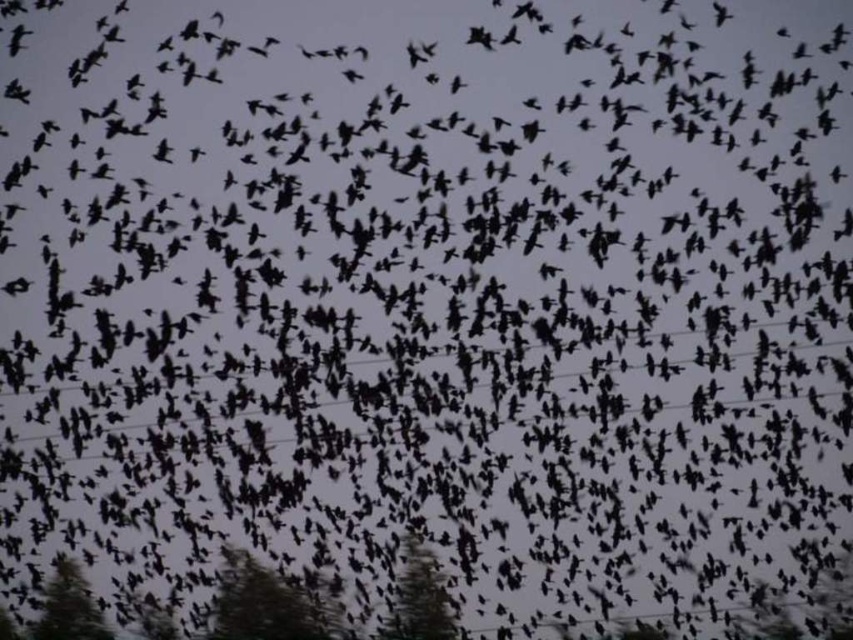
Question: Which object is positioned farthest from the green textured tree at center?

Choices:
 (A) green matte tree at lower left
 (B) green matte tree at lower center

Answer: (A)

Question: In this image, where is green matte tree at lower center located relative to green textured tree at center?

Choices:
 (A) left
 (B) right

Answer: (A)

Question: Does green matte tree at lower center have a smaller size compared to green textured tree at center?

Choices:
 (A) yes
 (B) no

Answer: (A)

Question: Which of these objects is positioned closest to the green matte tree at lower left?

Choices:
 (A) green textured tree at center
 (B) green matte tree at lower center

Answer: (B)

Question: Which point is closer to the camera?

Choices:
 (A) (251, 624)
 (B) (416, 630)
 (C) (70, 611)

Answer: (B)

Question: Is green textured tree at center smaller than green matte tree at lower left?

Choices:
 (A) yes
 (B) no

Answer: (A)